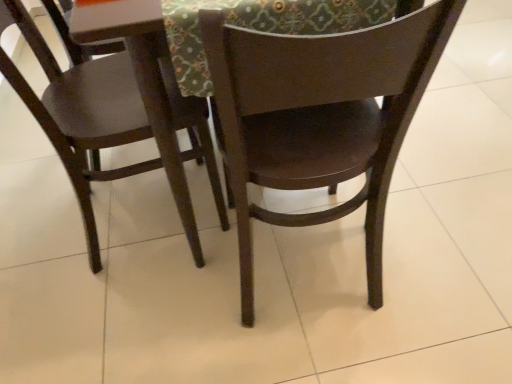
Question: Can you confirm if matte wood chair at left, which ranks as the 2th chair in right-to-left order, is shorter than dark wood chair at center, arranged as the second chair when viewed from the left?

Choices:
 (A) no
 (B) yes

Answer: (B)

Question: Does matte wood chair at left, which is counted as the first chair, starting from the left, have a lesser width compared to dark wood chair at center, the first chair viewed from the right?

Choices:
 (A) no
 (B) yes

Answer: (A)

Question: Is matte wood chair at left, which ranks as the 2th chair in right-to-left order, taller than dark wood chair at center, the first chair viewed from the right?

Choices:
 (A) yes
 (B) no

Answer: (B)

Question: Is matte wood chair at left, which is counted as the first chair, starting from the left, next to dark wood chair at center, the first chair viewed from the right?

Choices:
 (A) no
 (B) yes

Answer: (A)

Question: From the image's perspective, is matte wood chair at left, which ranks as the 2th chair in right-to-left order, on dark wood chair at center, arranged as the second chair when viewed from the left?

Choices:
 (A) no
 (B) yes

Answer: (B)

Question: Is matte wood chair at left, which is counted as the first chair, starting from the left, aimed at dark wood chair at center, the first chair viewed from the right?

Choices:
 (A) no
 (B) yes

Answer: (A)

Question: Is dark wood chair at center, the first chair viewed from the right, looking in the opposite direction of textured fabric at upper center?

Choices:
 (A) yes
 (B) no

Answer: (B)

Question: Is dark wood chair at center, arranged as the second chair when viewed from the left, behind textured fabric at upper center?

Choices:
 (A) no
 (B) yes

Answer: (A)

Question: Is dark wood chair at center, arranged as the second chair when viewed from the left, to the left of textured fabric at upper center from the viewer's perspective?

Choices:
 (A) yes
 (B) no

Answer: (B)

Question: Is dark wood chair at center, arranged as the second chair when viewed from the left, to the right of textured fabric at upper center from the viewer's perspective?

Choices:
 (A) no
 (B) yes

Answer: (B)

Question: Does dark wood chair at center, the first chair viewed from the right, have a smaller size compared to textured fabric at upper center?

Choices:
 (A) no
 (B) yes

Answer: (A)

Question: From a real-world perspective, is dark wood chair at center, the first chair viewed from the right, positioned over textured fabric at upper center based on gravity?

Choices:
 (A) yes
 (B) no

Answer: (B)

Question: Does textured fabric at upper center turn towards matte brown table at center?

Choices:
 (A) yes
 (B) no

Answer: (A)